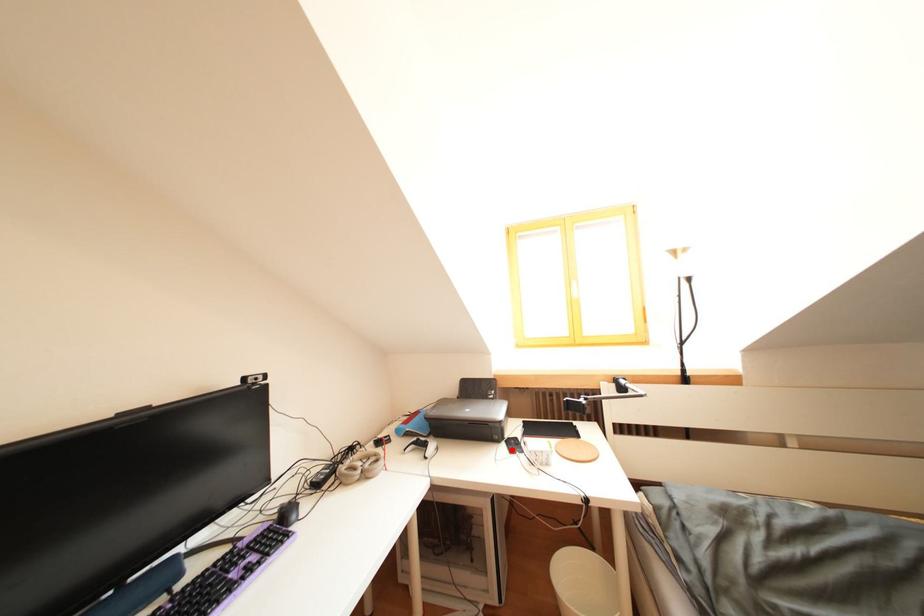
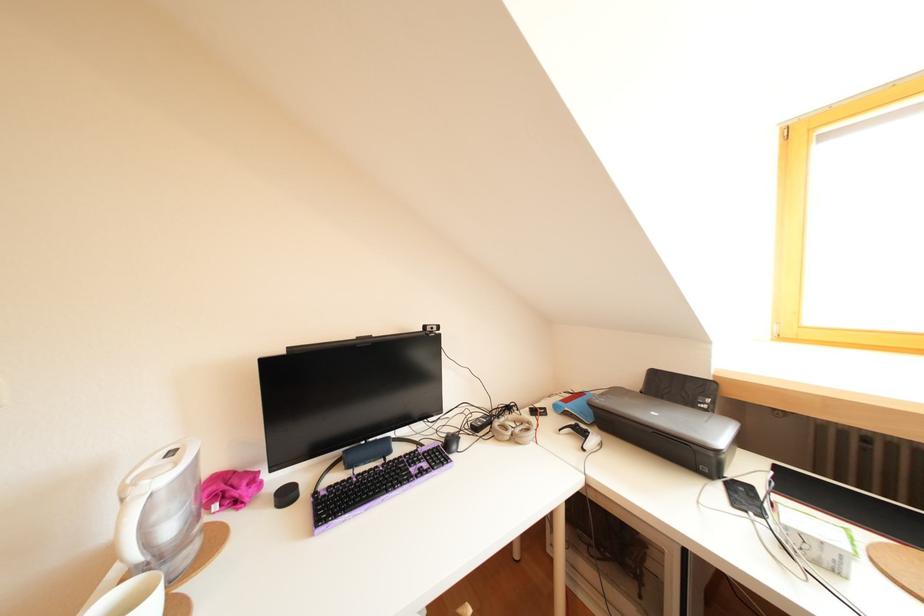
Question: I am providing you with two images of the same scene from different viewpoints. Given a red point in image1, look at the same physical point in image2. Is it:

Choices:
 (A) Closer to the viewpoint
 (B) Farther from the viewpoint

Answer: (A)